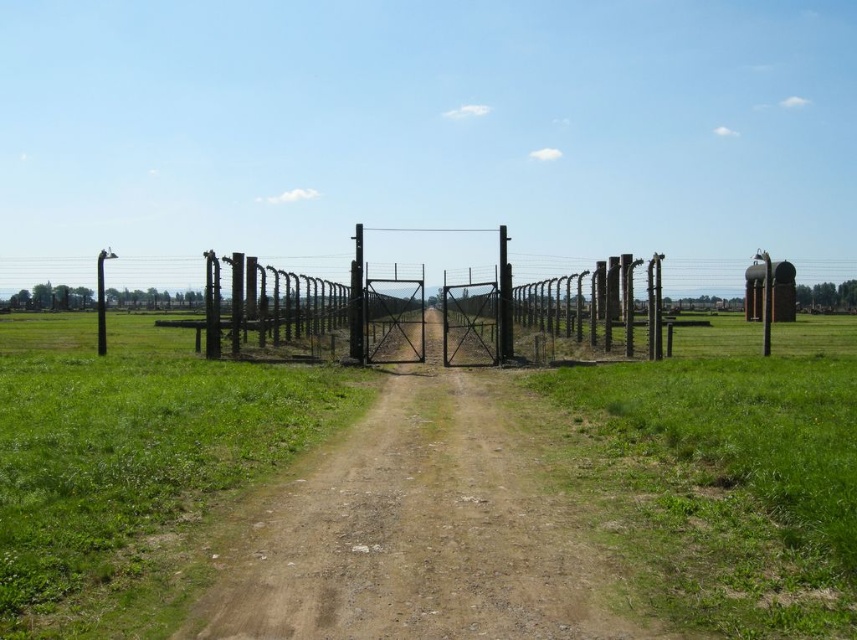
In the scene shown: Which is more to the left, brown dirt track at center or black metal pole at center?

brown dirt track at center is more to the left.

Can you confirm if brown dirt track at center is positioned above black metal pole at center?

No.

Is point (496, 552) positioned before point (498, 298)?

Yes, point (496, 552) is in front of point (498, 298).

The width and height of the screenshot is (857, 640). I want to click on brown dirt track at center, so click(x=417, y=532).

Which is in front, point (788, 516) or point (500, 288)?

Point (788, 516) is more forward.

Who is more distant from viewer, (750, 374) or (511, 308)?

The point (511, 308) is more distant.

Image resolution: width=857 pixels, height=640 pixels. Identify the location of green grass at right. (730, 476).

This screenshot has height=640, width=857. Find the location of `green grass at right`. green grass at right is located at coordinates (730, 476).

Does black metal pole at center appear on the left side of black metal pole at left?

In fact, black metal pole at center is to the right of black metal pole at left.

Identify the location of black metal pole at center. Image resolution: width=857 pixels, height=640 pixels. (504, 298).